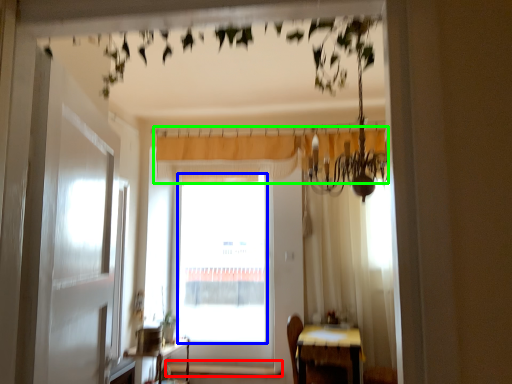
Question: Estimate the real-world distances between objects in this image. Which object is farther from window sill (highlighted by a red box), window screen (highlighted by a blue box) or curtain (highlighted by a green box)?

Choices:
 (A) window screen
 (B) curtain

Answer: (B)